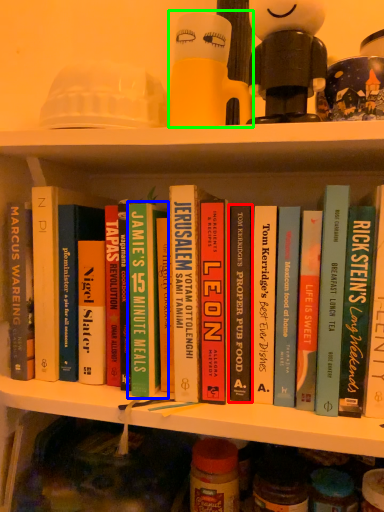
Question: Estimate the real-world distances between objects in this image. Which object is closer to book (highlighted by a red box), book (highlighted by a blue box) or toy (highlighted by a green box)?

Choices:
 (A) book
 (B) toy

Answer: (A)